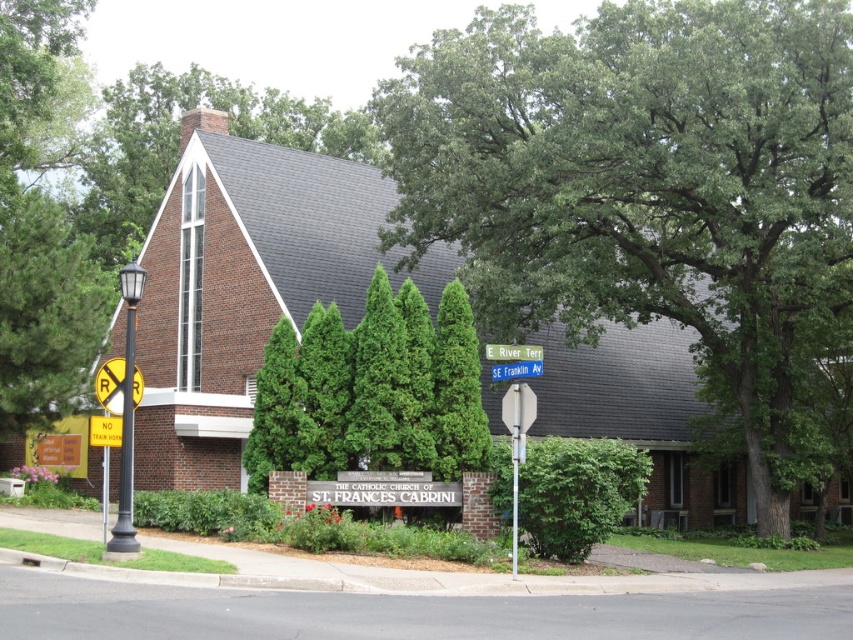
Can you confirm if green leafy tree at center is wider than green leafy bush at center?

Yes, green leafy tree at center is wider than green leafy bush at center.

Does point (469, 86) come farther from viewer compared to point (592, 531)?

That is True.

Where is `green leafy tree at center`? Image resolution: width=853 pixels, height=640 pixels. green leafy tree at center is located at coordinates (645, 186).

Is black metal street sign at left shorter than yellow plastic sign at left?

No.

Who is positioned more to the left, black metal street sign at left or yellow plastic sign at left?

yellow plastic sign at left is more to the left.

The width and height of the screenshot is (853, 640). What do you see at coordinates (125, 454) in the screenshot?
I see `black metal street sign at left` at bounding box center [125, 454].

Where is `black metal street sign at left`? The height and width of the screenshot is (640, 853). black metal street sign at left is located at coordinates (125, 454).

What do you see at coordinates (125, 454) in the screenshot? The height and width of the screenshot is (640, 853). I see `black metal street sign at left` at bounding box center [125, 454].

Between black metal street sign at left and yellowmaterial/texturesign at upper center, which one is positioned higher?

Positioned higher is yellowmaterial/texturesign at upper center.

Locate an element on the screen. black metal street sign at left is located at coordinates (125, 454).

What are the coordinates of `black metal street sign at left` in the screenshot? It's located at (125, 454).